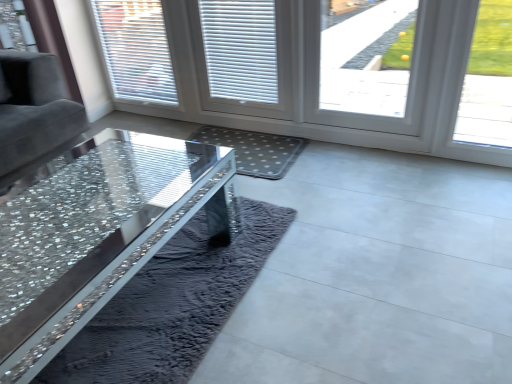
Question: Looking at the image, does transparent glass window at upper right, the first window viewed from the front, seem bigger or smaller compared to smooth concrete floor at center?

Choices:
 (A) big
 (B) small

Answer: (B)

Question: Considering their positions, is transparent glass window at upper right, arranged as the 2th window when viewed from the back, located in front of or behind smooth concrete floor at center?

Choices:
 (A) front
 (B) behind

Answer: (B)

Question: Which object is positioned farthest from the white plastic screen door at center?

Choices:
 (A) smooth concrete floor at center
 (B) gray dotted mat at center
 (C) crystal glass table at center
 (D) white textured blinds at upper left, marked as the 1th window in a left-to-right arrangement
 (E) white plastic blinds at center

Answer: (A)

Question: Based on their relative distances, which object is nearer to the transparent glass window at upper right, the first window viewed from the front?

Choices:
 (A) crystal glass table at center
 (B) white plastic blinds at center
 (C) white plastic screen door at center
 (D) smooth concrete floor at center
 (E) gray dotted mat at center

Answer: (B)